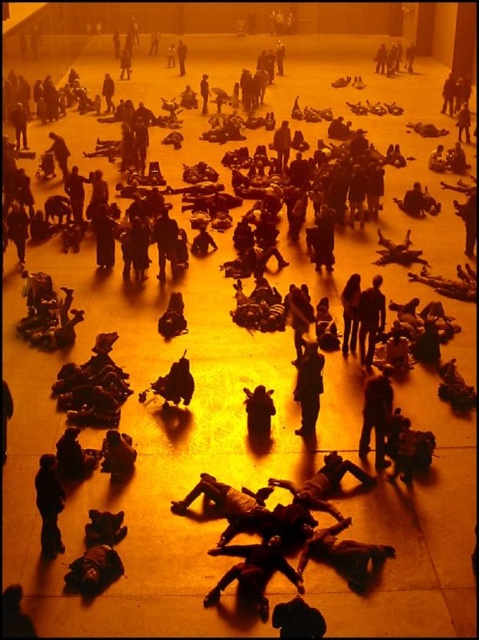
You are organizing a clothing store and need to place the dark brown leather jacket at center and the dark brown leather bag at center on a shelf. Which one should you place first if you want to ensure the narrower item is placed first?

The dark brown leather jacket at center should be placed first because its width is less than the dark brown leather bag at center, making it the narrower item.

You are a photographer setting up a shoot in this space. You need to position a light stand between the dark gray fabric figure at lower left and the dark brown leather jacket at center so that it doesn

The dark gray fabric figure at lower left is shorter than the dark brown leather jacket at center. Therefore, placing the light stand between them would require positioning it closer to the taller dark brown leather jacket at center to maintain balance in the lighting setup.